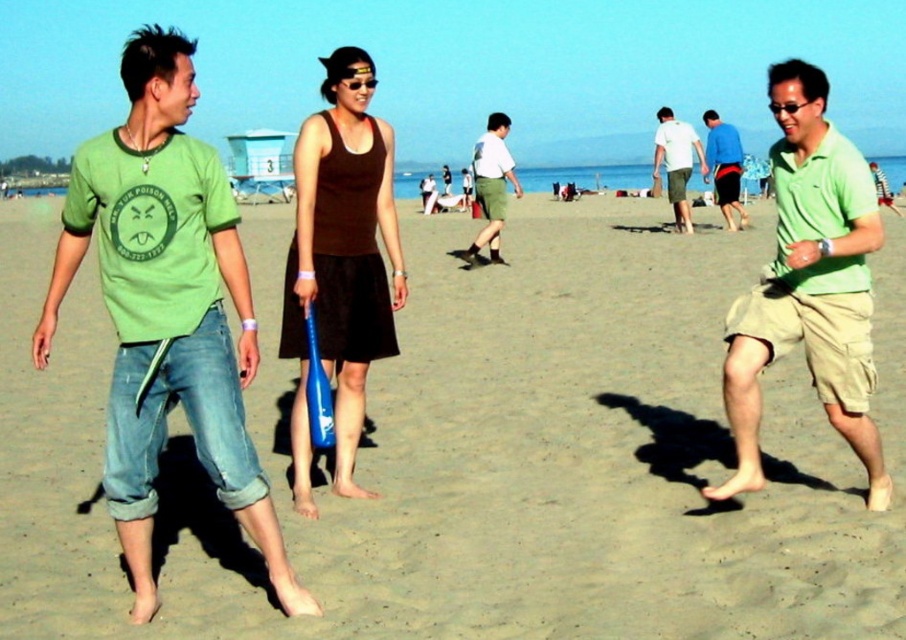
You are a photographer planning to capture a wide shot of the beach scene. Given that the smooth tan sand at center and the green matte shirt at center are both in the frame, which object occupies more horizontal space in the photo?

The smooth tan sand at center occupies more horizontal space in the photo because its width is larger than that of the green matte shirt at center.

You are a photographer trying to capture a candid shot of the two people at the center of the beach scene. You need to adjust your camera settings so that both the green matte shirt at center and the blue fabric shorts at center are in focus. Which object should you focus on first to ensure both are sharp?

The green matte shirt at center is shorter than the blue fabric shorts at center. To ensure both are in focus, you should focus on the green matte shirt at center first since it is closer to the camera.